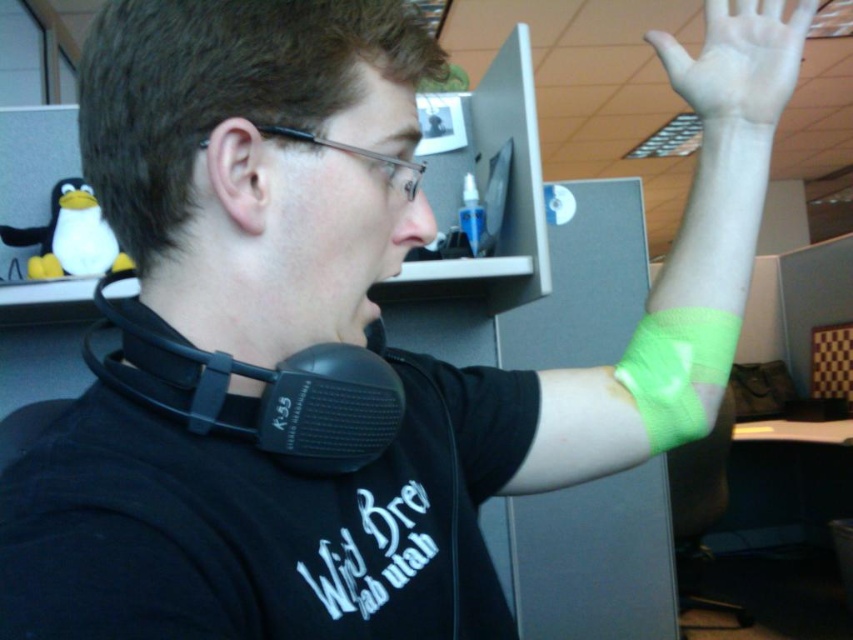
You are a delivery robot in an office. You need to deliver a package to the person wearing a black T shirt with white text. The package must be placed on the desk at point (683, 259). However, there is a green fabric wristband at upper right near that point. Can you place the package there without disturbing the wristband?

The green fabric wristband at upper right is located at point (683, 259). Since the package needs to be placed at that exact point where the wristband is, it would disturb the wristband. Therefore, you should find another location on the desk to place the package.

The scene shows a person in an office with a green fabric wristband at upper right and a green fabric bandage at upper right. Which object is wider?

The green fabric wristband at upper right is wider than the green fabric bandage at upper right.

You are an office worker who needs to locate your green fabric wristband at upper right and black matte headphones at center. According to the scene, which object is located to the right of the other?

The green fabric wristband at upper right is positioned on the right side of black matte headphones at center.